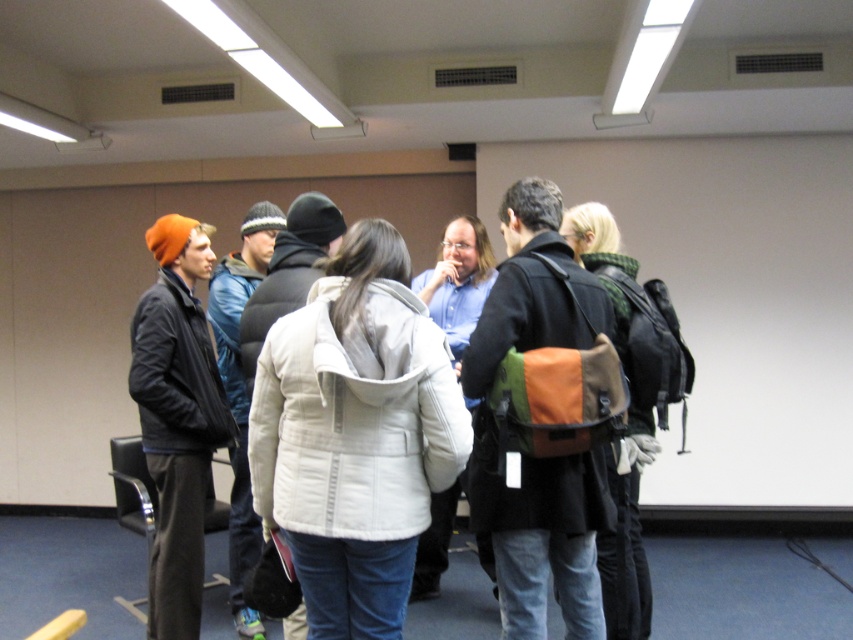
Is the position of orange fabric backpack at center more distant than that of blue shirt at center?

No, orange fabric backpack at center is in front of blue shirt at center.

Describe the element at coordinates (541, 532) in the screenshot. This screenshot has width=853, height=640. I see `orange fabric backpack at center` at that location.

Between point (496, 580) and point (437, 552), which one is positioned behind?

Positioned behind is point (437, 552).

In order to click on orange fabric backpack at center in this screenshot , I will do `click(541, 532)`.

Does point (474, 445) come in front of point (154, 484)?

Yes, point (474, 445) is closer to viewer.

Is orange fabric backpack at center to the right of matte black jacket at left from the viewer's perspective?

Indeed, orange fabric backpack at center is positioned on the right side of matte black jacket at left.

Is point (471, 481) behind point (189, 538)?

That is False.

You are a GUI agent. You are given a task and a screenshot of the screen. Output one action in this format:
    pyautogui.click(x=<x>, y=<y>)
    Task: Click on the orange fabric backpack at center
    Image resolution: width=853 pixels, height=640 pixels.
    Given the screenshot: What is the action you would take?
    pyautogui.click(x=541, y=532)

Is white puffy jacket at center to the right of blue shirt at center from the viewer's perspective?

In fact, white puffy jacket at center is to the left of blue shirt at center.

Is white puffy jacket at center shorter than blue shirt at center?

Incorrect, white puffy jacket at center's height does not fall short of blue shirt at center's.

Does point (311, 596) come in front of point (427, 588)?

Yes, it is.

Where is `white puffy jacket at center`? This screenshot has width=853, height=640. white puffy jacket at center is located at coordinates (355, 435).